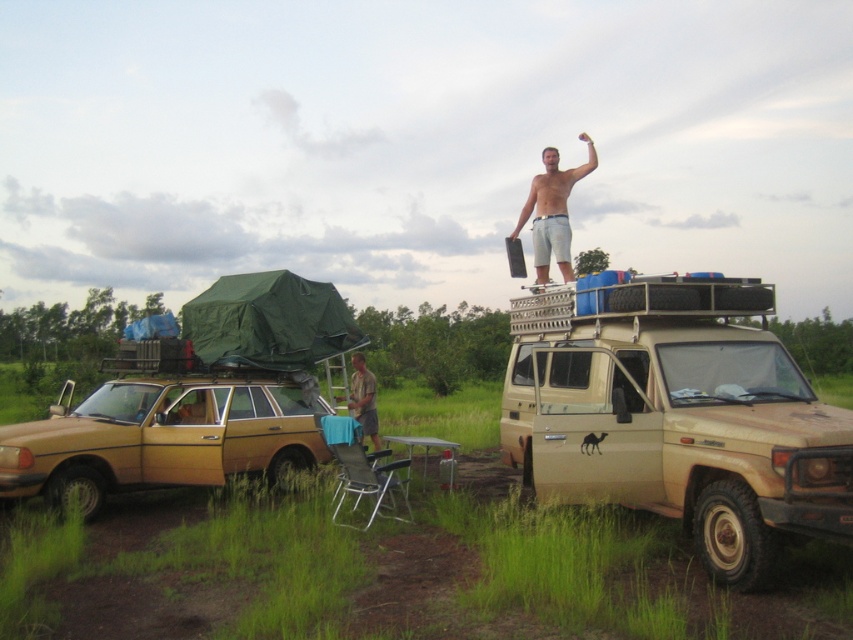
Question: Is gold matte station wagon at lower left further to the viewer compared to skinny white shorts at upper right?

Choices:
 (A) no
 (B) yes

Answer: (A)

Question: Does beige matte pickup truck at upper right appear under gold matte station wagon at lower left?

Choices:
 (A) yes
 (B) no

Answer: (B)

Question: Among these objects, which one is nearest to the camera?

Choices:
 (A) gold matte station wagon at lower left
 (B) beige matte pickup truck at upper right
 (C) brown fabric shirt at center

Answer: (B)

Question: Which of the following is the closest to the observer?

Choices:
 (A) brown fabric shirt at center
 (B) gold matte station wagon at lower left
 (C) skinny white shorts at upper right
 (D) beige matte pickup truck at upper right

Answer: (D)

Question: Does gold matte station wagon at lower left have a greater width compared to brown fabric shirt at center?

Choices:
 (A) yes
 (B) no

Answer: (A)

Question: Which object is closer to the camera taking this photo?

Choices:
 (A) brown fabric shirt at center
 (B) skinny white shorts at upper right
 (C) gold matte station wagon at lower left
 (D) beige matte pickup truck at upper right

Answer: (D)